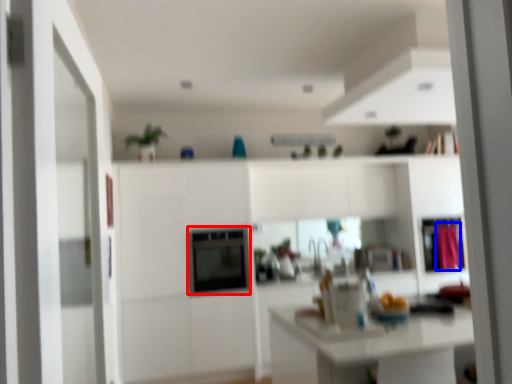
Question: Which object appears farthest to the camera in this image, appliance (highlighted by a red box) or curtain (highlighted by a blue box)?

Choices:
 (A) appliance
 (B) curtain

Answer: (B)